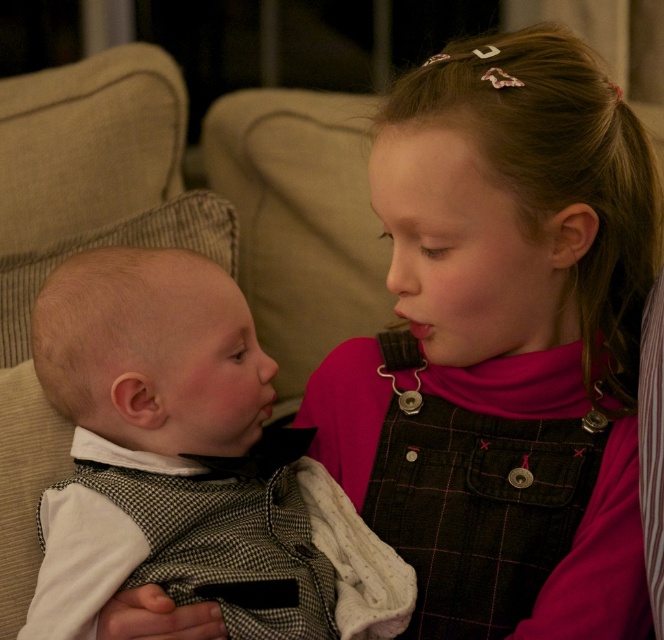
What is located at the coordinates point (503, 342)?

The pink cotton dress at center is located at point (503, 342).

You are a fashion designer who needs to decide which clothing item to display in a narrow storefront window. Given the pink cotton dress at center and the white cotton shirt at left, which one would you choose to ensure it fits well in the limited space?

The pink cotton dress at center has a lesser width compared to the white cotton shirt at left, so it would fit better in the narrow storefront window.